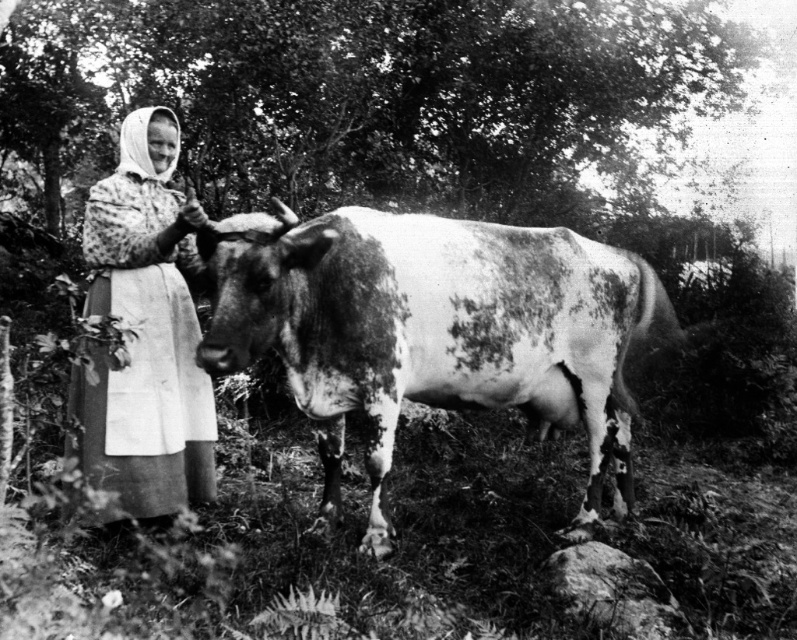
Question: Among these points, which one is nearest to the camera?

Choices:
 (A) (338, 232)
 (B) (105, 404)

Answer: (B)

Question: Does speckled fur at center appear on the right side of floral-patterned fabric at left?

Choices:
 (A) no
 (B) yes

Answer: (B)

Question: Does speckled fur at center appear over floral-patterned fabric at left?

Choices:
 (A) yes
 (B) no

Answer: (B)

Question: Can you confirm if speckled fur at center is wider than floral-patterned fabric at left?

Choices:
 (A) yes
 (B) no

Answer: (A)